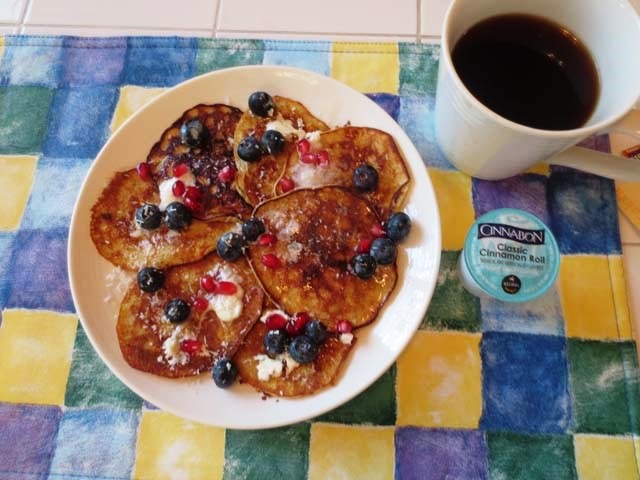
Locate an element on the screen. This screenshot has height=480, width=640. tiled bench top is located at coordinates (374, 15).